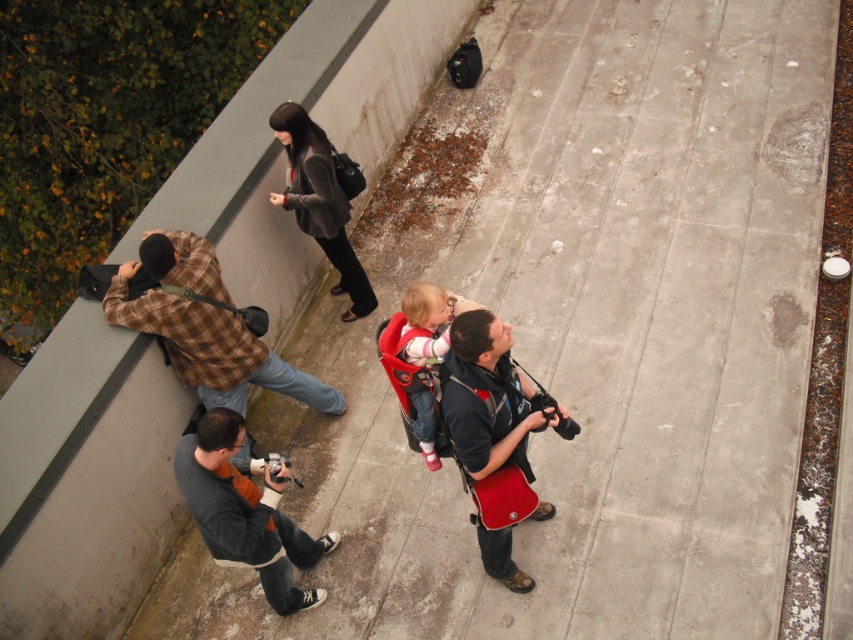
You are standing on the rooftop platform and want to place a small potted plant between the two points marked as point (125, 456) and point (425, 420). Which point should the plant be closer to in order to be nearer to the viewer?

The plant should be closer to point (125, 456) because it is further to the viewer than point (425, 420).

From the picture: You are a photographer trying to capture a candid shot of the brown plaid shirt at left without the matte black backpack at center blocking the view. Can you move to a position where the backpack is out of frame?

The matte black backpack at center is behind the brown plaid shirt at left, so moving to a position where you can see the brown plaid shirt at left from the front or side should allow you to avoid the backpack blocking the view.

You are a photographer trying to capture a photo of the baby in the matte pink baby carrier at center without including the person in the velvet brown jacket at upper center in the frame. Based on their positions, is this possible?

The velvet brown jacket at upper center is located above the matte pink baby carrier at center, so it is likely blocking the direct line of sight. To avoid including the velvet brown jacket at upper center in the photo, you might need to adjust your angle or position to frame the baby carrier without the jacket obstructing it.